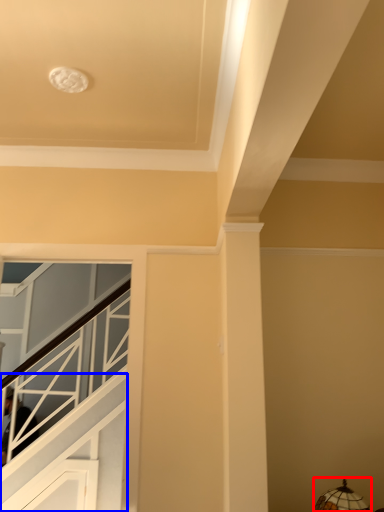
Question: Among these objects, which one is nearest to the camera, lamp (highlighted by a red box) or stairwell (highlighted by a blue box)?

Choices:
 (A) lamp
 (B) stairwell

Answer: (A)